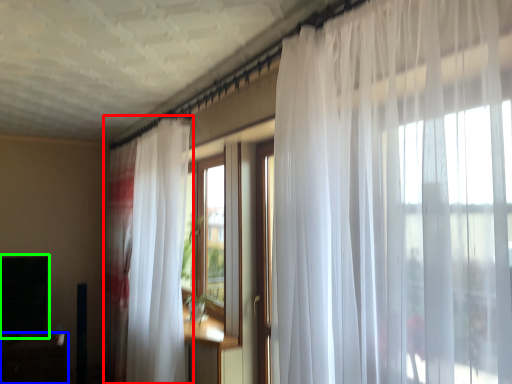
Question: Which object is the farthest from curtain (highlighted by a red box)? Choose among these: table (highlighted by a blue box) or window screen (highlighted by a green box).

Choices:
 (A) table
 (B) window screen

Answer: (A)